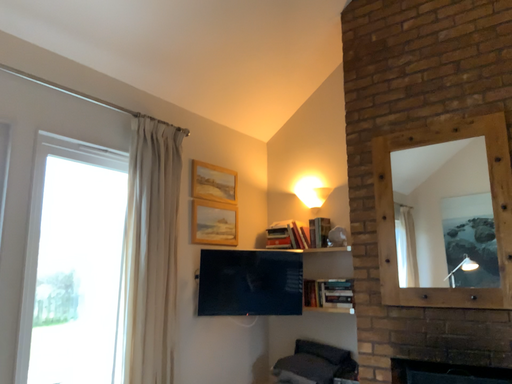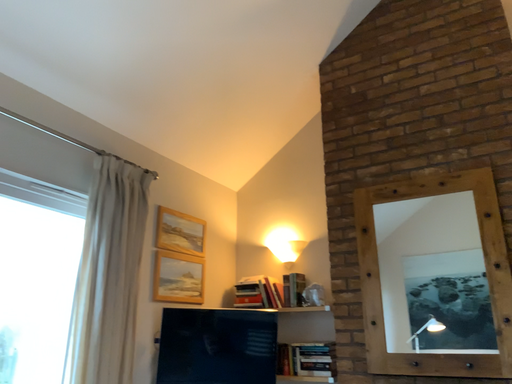
Question: Which way did the camera rotate in the video?

Choices:
 (A) rotated downward
 (B) rotated upward

Answer: (B)